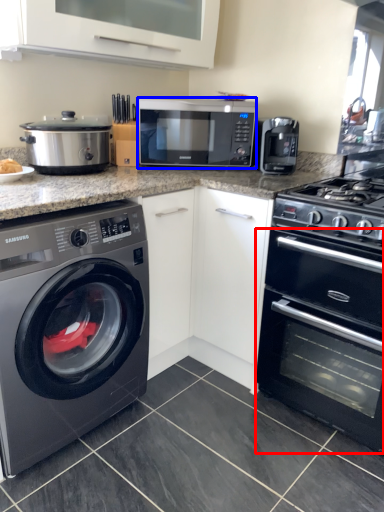
Question: Which point is closer to the camera, oven (highlighted by a red box) or microwave oven (highlighted by a blue box)?

Choices:
 (A) oven
 (B) microwave oven

Answer: (A)